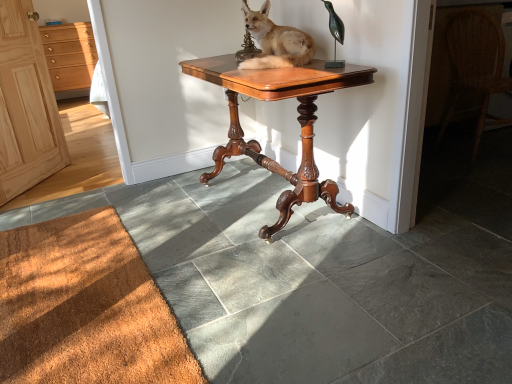
Measure the distance between light wood cabinet at left and camera.

The depth of light wood cabinet at left is 5.87 meters.

You are a GUI agent. You are given a task and a screenshot of the screen. Output one action in this format:
    pyautogui.click(x=<x>, y=<y>)
    Task: Click on the mahogany wood table at center
    
    Given the screenshot: What is the action you would take?
    pyautogui.click(x=297, y=119)

Describe the element at coordinates (26, 105) in the screenshot. This screenshot has width=512, height=384. I see `natural wood cabinet at left` at that location.

Identify the location of brown fur stuffed fox at center. The image size is (512, 384). (275, 41).

Is natural wood cabinet at left not within mahogany wood table at center?

natural wood cabinet at left lies outside mahogany wood table at center's area.

Considering the relative sizes of natural wood cabinet at left and mahogany wood table at center in the image provided, is natural wood cabinet at left taller than mahogany wood table at center?

Indeed, natural wood cabinet at left has a greater height compared to mahogany wood table at center.

From a real-world perspective, between natural wood cabinet at left and mahogany wood table at center, who is vertically lower?

In real-world perspective, mahogany wood table at center is lower.

Based on the photo, considering the relative positions of brown fur stuffed fox at center and light wood cabinet at left in the image provided, is brown fur stuffed fox at center to the left of light wood cabinet at left from the viewer's perspective?

No, brown fur stuffed fox at center is not to the left of light wood cabinet at left.

Between point (260, 59) and point (63, 55), which one is positioned behind?

The point (63, 55) is farther from the camera.

Which of these two, brown fur stuffed fox at center or light wood cabinet at left, is thinner?

brown fur stuffed fox at center.

In the image, is natural wood cabinet at left on the left side or the right side of woven wicker chair at right?

natural wood cabinet at left is to the left of woven wicker chair at right.

Is natural wood cabinet at left oriented towards woven wicker chair at right?

Yes, natural wood cabinet at left is aimed at woven wicker chair at right.

Between natural wood cabinet at left and woven wicker chair at right, which one has more height?

Standing taller between the two is natural wood cabinet at left.

Can you confirm if natural wood cabinet at left is wider than woven wicker chair at right?

Incorrect, the width of natural wood cabinet at left does not surpass that of woven wicker chair at right.

Is natural wood cabinet at left at the back of brown fur stuffed fox at center?

No, brown fur stuffed fox at center is not facing the opposite direction of natural wood cabinet at left.

Who is bigger, brown fur stuffed fox at center or natural wood cabinet at left?

natural wood cabinet at left.

Which of these two, brown fur stuffed fox at center or natural wood cabinet at left, is thinner?

natural wood cabinet at left is thinner.

Is brown fur stuffed fox at center not within natural wood cabinet at left?

Yes, brown fur stuffed fox at center is located beyond the bounds of natural wood cabinet at left.

Is woven wicker chair at right far away from brown textured mat at lower left?

Yes.

Is woven wicker chair at right looking in the opposite direction of brown textured mat at lower left?

woven wicker chair at right does not have its back to brown textured mat at lower left.

Which object is thinner, woven wicker chair at right or brown textured mat at lower left?

Thinner between the two is brown textured mat at lower left.

Is woven wicker chair at right situated inside brown textured mat at lower left or outside?

woven wicker chair at right lies outside brown textured mat at lower left.

From the image's perspective, would you say brown textured mat at lower left is shown under natural wood cabinet at left?

Indeed, from the image's perspective, brown textured mat at lower left is shown beneath natural wood cabinet at left.

From a real-world perspective, is brown textured mat at lower left on top of natural wood cabinet at left?

No, from a real-world perspective, brown textured mat at lower left is not over natural wood cabinet at left

Are brown textured mat at lower left and natural wood cabinet at left far apart?

Absolutely, brown textured mat at lower left is distant from natural wood cabinet at left.

Which of these two, brown textured mat at lower left or natural wood cabinet at left, is smaller?

brown textured mat at lower left.

Where is `screen door below the light wood cabinet at left (from the image's perspective)`? The image size is (512, 384). screen door below the light wood cabinet at left (from the image's perspective) is located at coordinates (26, 105).

From the image's perspective, is light wood cabinet at left positioned above or below natural wood cabinet at left?

light wood cabinet at left is situated higher than natural wood cabinet at left in the image.

From a real-world perspective, which object stands above the other?

natural wood cabinet at left is physically above.

Is light wood cabinet at left facing towards natural wood cabinet at left?

Yes, light wood cabinet at left faces towards natural wood cabinet at left.

At what (x,y) coordinates should I click in order to perform the action: click on table on the right side of natural wood cabinet at left. Please return your answer as a coordinate pair (x, y). Looking at the image, I should click on (297, 119).

This screenshot has width=512, height=384. In the image, there is a brown fur stuffed fox at center. Find the location of `cabinetry below it (from a real-world perspective)`. cabinetry below it (from a real-world perspective) is located at coordinates (69, 55).

Which object lies nearer to the anchor point brown fur stuffed fox at center, mahogany wood table at center or woven wicker chair at right?

mahogany wood table at center lies closer to brown fur stuffed fox at center than the other object.

Based on their spatial positions, is brown fur stuffed fox at center or brown textured mat at lower left further from light wood cabinet at left?

Based on the image, brown textured mat at lower left appears to be further to light wood cabinet at left.

When comparing their distances from brown fur stuffed fox at center, does mahogany wood table at center or natural wood cabinet at left seem closer?

mahogany wood table at center is closer to brown fur stuffed fox at center.

Looking at the image, which one is located further to light wood cabinet at left, brown textured mat at lower left or natural wood cabinet at left?

brown textured mat at lower left.

From the image, which object appears to be farther from natural wood cabinet at left, woven wicker chair at right or brown textured mat at lower left?

Among the two, woven wicker chair at right is located further to natural wood cabinet at left.

Which object lies further to the anchor point woven wicker chair at right, brown textured mat at lower left or natural wood cabinet at left?

A: The object further to woven wicker chair at right is natural wood cabinet at left.

From the image, which object appears to be nearer to brown fur stuffed fox at center, light wood cabinet at left or brown textured mat at lower left?

The object closer to brown fur stuffed fox at center is brown textured mat at lower left.

Considering their positions, is light wood cabinet at left positioned further to brown fur stuffed fox at center than mahogany wood table at center?

Among the two, light wood cabinet at left is located further to brown fur stuffed fox at center.

Where is `table between brown fur stuffed fox at center and woven wicker chair at right from left to right`? The image size is (512, 384). table between brown fur stuffed fox at center and woven wicker chair at right from left to right is located at coordinates (297, 119).

In order to click on dog located between natural wood cabinet at left and woven wicker chair at right in the left-right direction in this screenshot , I will do `click(275, 41)`.

The image size is (512, 384). I want to click on chair between brown textured mat at lower left and light wood cabinet at left along the z-axis, so click(x=474, y=68).

Image resolution: width=512 pixels, height=384 pixels. What are the coordinates of `table between brown textured mat at lower left and light wood cabinet at left from front to back` in the screenshot? It's located at (297, 119).